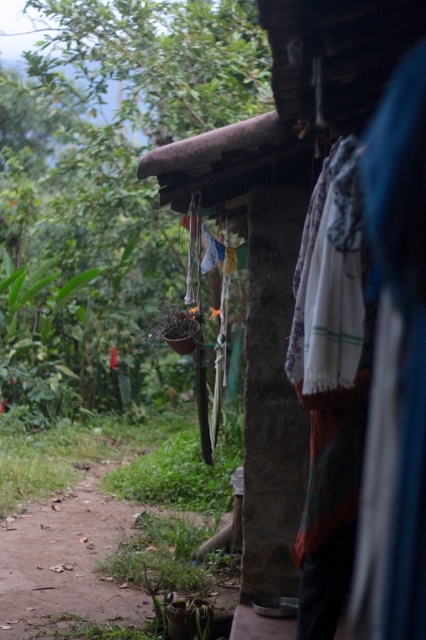
Does green leafy plant at center have a lesser width compared to rustic wooden hut at center?

Yes.

What are the coordinates of `green leafy plant at center` in the screenshot? It's located at (120, 147).

The width and height of the screenshot is (426, 640). I want to click on green leafy plant at center, so pos(120,147).